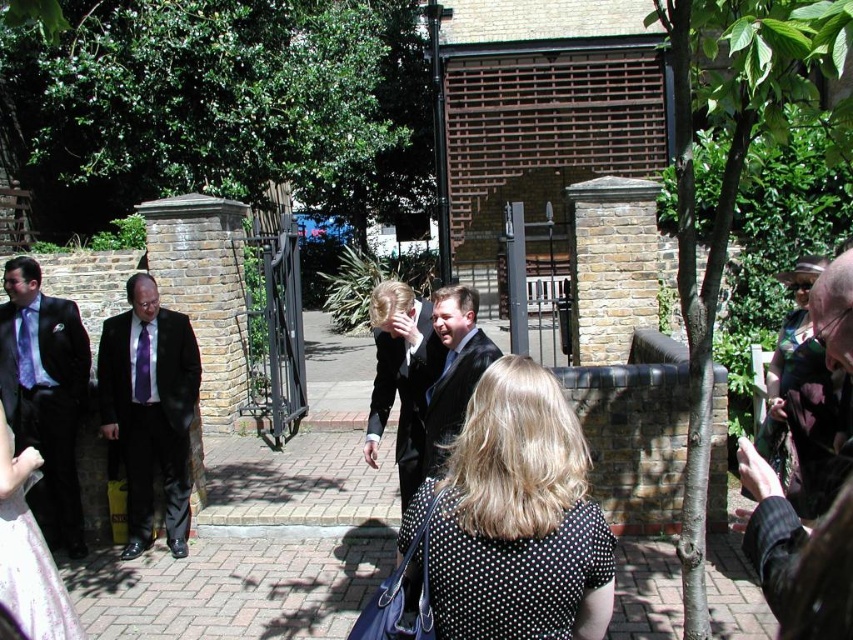
You are a photographer at the event and need to capture both the matte purple tie at left and the purple satin tie at center in a single frame. Since the camera can only focus on one tie at a time, which tie should you focus on first to ensure both are in the shot?

You should focus on the matte purple tie at left first because it is positioned to the left of the purple satin tie at center, so by centering the camera on the leftmost tie, both will be included in the frame.

In the scene shown: You are a photographer at a formal event. You need to capture a closeup of both the purple satin tie at left and the purple satin tie at center. Which tie will appear wider in the photo?

The purple satin tie at center will appear wider in the photo because it is thicker than the purple satin tie at left.